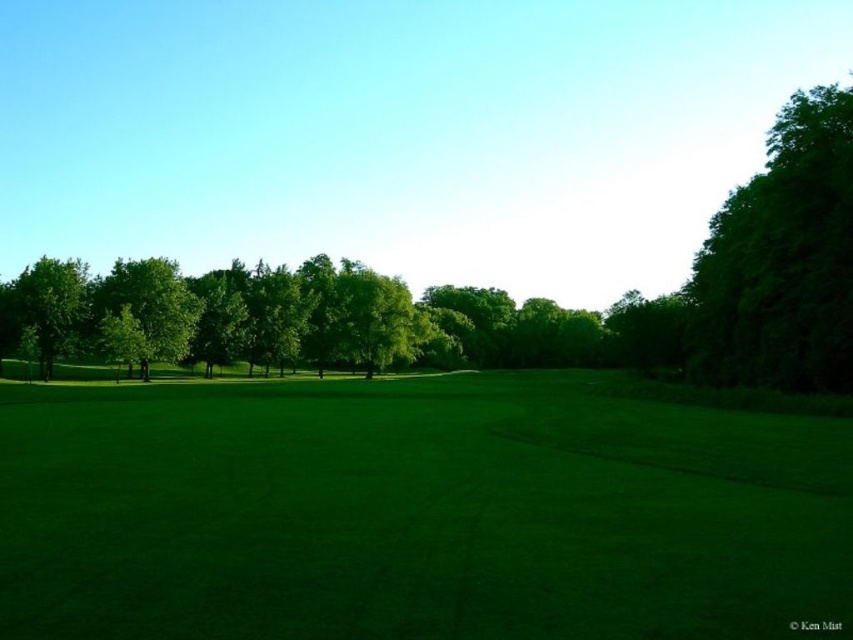
Is point (76, 442) positioned behind point (808, 358)?

No, (76, 442) is in front of (808, 358).

Is green grass at center shorter than green leafy tree at right?

Yes.

What do you see at coordinates (416, 513) in the screenshot?
I see `green grass at center` at bounding box center [416, 513].

Find the location of a particular element. The width and height of the screenshot is (853, 640). green grass at center is located at coordinates (416, 513).

Does green leafy tree at center have a lesser width compared to green leafy tree at left?

No.

Between green leafy tree at center and green leafy tree at left, which one is positioned higher?

green leafy tree at center

This screenshot has width=853, height=640. What do you see at coordinates (154, 305) in the screenshot? I see `green leafy tree at center` at bounding box center [154, 305].

Where is `green leafy tree at center`? The image size is (853, 640). green leafy tree at center is located at coordinates (154, 305).

Which is more to the right, green leafy tree at right or green leafy tree at center?

green leafy tree at right

Is green leafy tree at right smaller than green leafy tree at center?

No.

The height and width of the screenshot is (640, 853). Identify the location of green leafy tree at right. (781, 259).